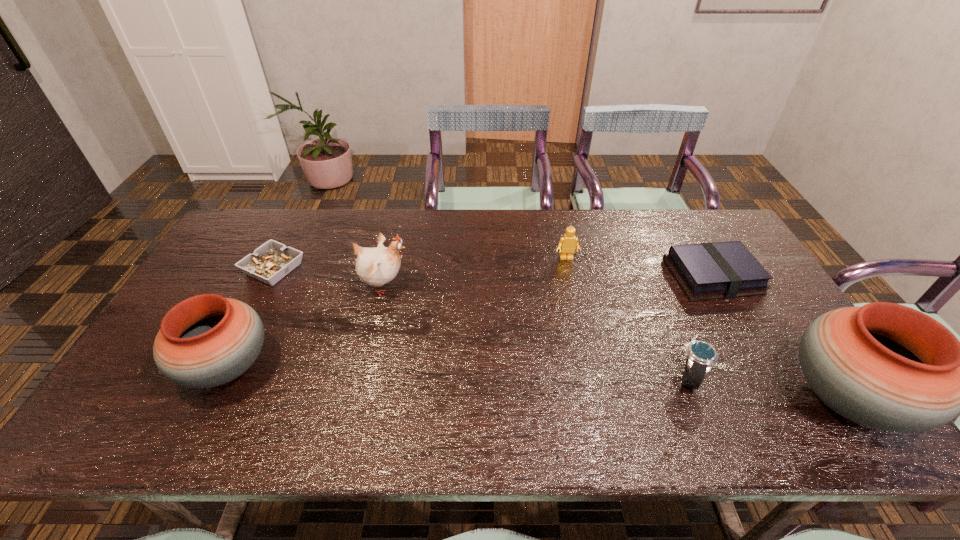
Locate an element on the screen. The image size is (960, 540). vacant position located on the back of the shorter pottery is located at coordinates (281, 260).

The image size is (960, 540). Identify the location of free location located 0.340m on the back of the right pottery. (753, 264).

This screenshot has height=540, width=960. Find the location of `blank space located 0.140m at the beak of the bird`. blank space located 0.140m at the beak of the bird is located at coordinates (457, 286).

Locate an element on the screen. The width and height of the screenshot is (960, 540). vacant space situated on the back of the shortest object is located at coordinates (300, 218).

The width and height of the screenshot is (960, 540). I want to click on vacant space situated 0.220m on the back of the second shortest object, so click(678, 214).

The image size is (960, 540). I want to click on free region located 0.110m on the face of the fourth tallest object, so click(x=573, y=287).

In order to click on blank space located on the back of the fifth object from left to right in this screenshot , I will do `click(651, 282)`.

Image resolution: width=960 pixels, height=540 pixels. I want to click on object at the far edge, so click(269, 263).

The image size is (960, 540). I want to click on watch that is at the near edge, so click(701, 356).

Image resolution: width=960 pixels, height=540 pixels. I want to click on pottery located in the left edge section of the desktop, so click(x=207, y=340).